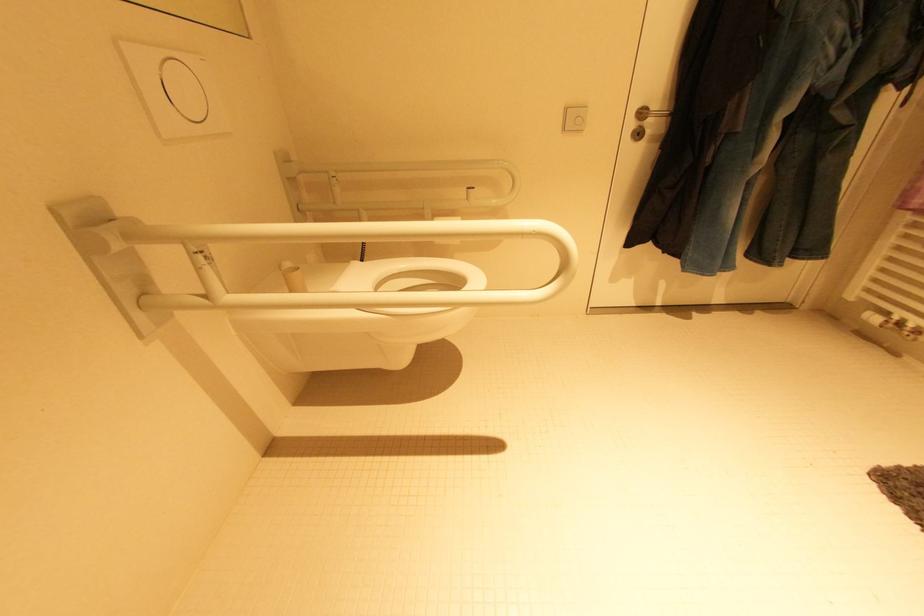
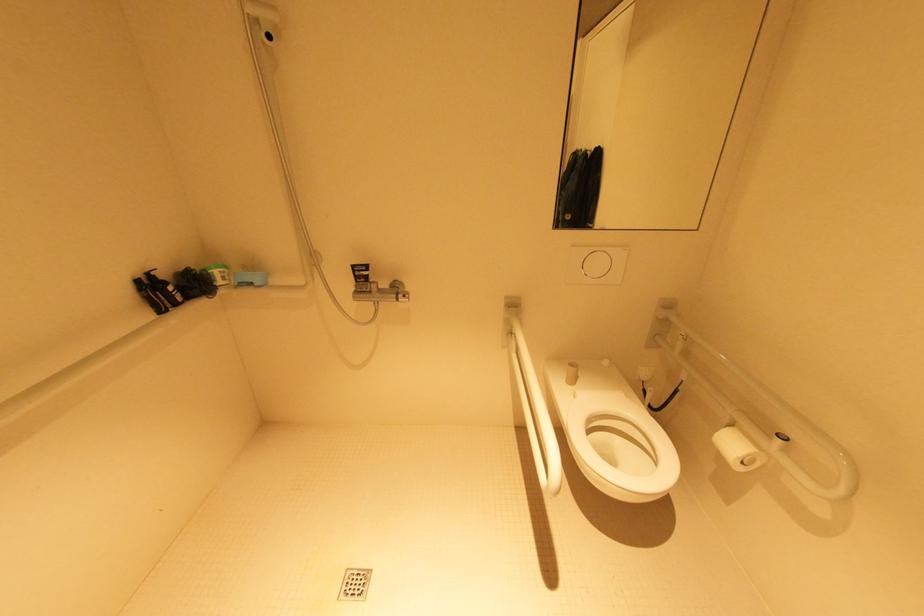
The images are taken continuously from a first-person perspective. In which direction is your viewpoint rotating?

The camera's rotation is toward left-down.